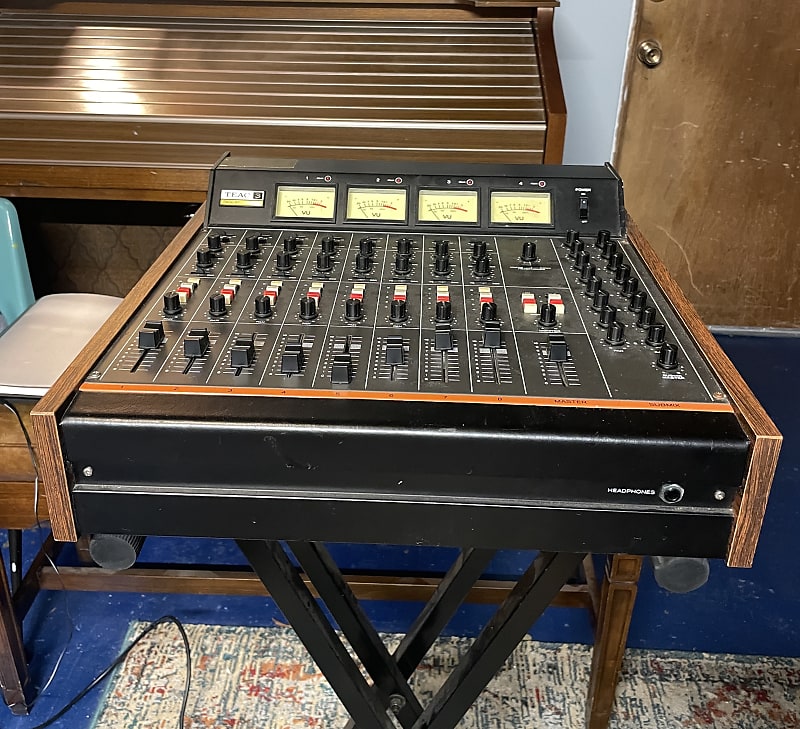
Where is `golden knob`? golden knob is located at coordinates (652, 58).